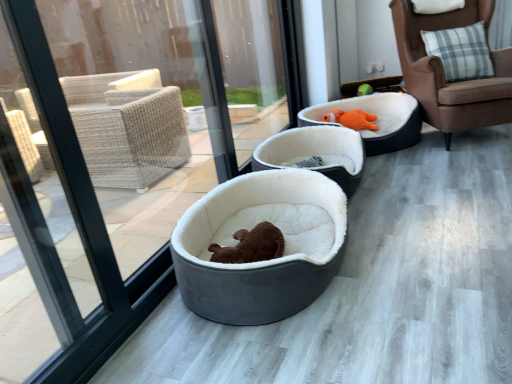
You are a GUI agent. You are given a task and a screenshot of the screen. Output one action in this format:
    pyautogui.click(x=<x>, y=<y>)
    Task: Click on the orange plush toy at upper right
    This screenshot has width=512, height=384.
    Given the screenshot: What is the action you would take?
    pyautogui.click(x=352, y=119)

Image resolution: width=512 pixels, height=384 pixels. I want to click on velvet gray dog bed at center, which ranks as the 1th dog bed in front-to-back order, so click(x=256, y=262).

You are a GUI agent. You are given a task and a screenshot of the screen. Output one action in this format:
    pyautogui.click(x=<x>, y=<y>)
    Task: Click on the soft white fur bed at center, acting as the second dog bed starting from the front
    
    Given the screenshot: What is the action you would take?
    pyautogui.click(x=316, y=153)

Does velvet gray dog bed at center, which ranks as the 1th dog bed in front-to-back order, appear on the right side of orange plush toy at upper right?

No, velvet gray dog bed at center, which ranks as the 1th dog bed in front-to-back order, is not to the right of orange plush toy at upper right.

What's the angular difference between velvet gray dog bed at center, which is the 3th dog bed in back-to-front order, and orange plush toy at upper right's facing directions?

There is a 78.2-degree angle between the facing directions of velvet gray dog bed at center, which is the 3th dog bed in back-to-front order, and orange plush toy at upper right.

Is point (343, 232) in front of point (359, 115)?

Yes, it is.

Which is in front, velvet gray dog bed at center, which ranks as the 1th dog bed in front-to-back order, or orange plush toy at upper right?

velvet gray dog bed at center, which ranks as the 1th dog bed in front-to-back order, is in front.

From the image's perspective, is velvet gray dog bed at center, which ranks as the 1th dog bed in front-to-back order, under soft white fur bed at center, positioned as the 2th dog bed in back-to-front order?

Yes, from the image's perspective, velvet gray dog bed at center, which ranks as the 1th dog bed in front-to-back order, is below soft white fur bed at center, positioned as the 2th dog bed in back-to-front order.

Considering the points (332, 276) and (354, 164), which point is in front, point (332, 276) or point (354, 164)?

Point (332, 276)

Is velvet gray dog bed at center, which is the 3th dog bed in back-to-front order, facing away from soft white fur bed at center, positioned as the 2th dog bed in back-to-front order?

No, velvet gray dog bed at center, which is the 3th dog bed in back-to-front order,'s orientation is not away from soft white fur bed at center, positioned as the 2th dog bed in back-to-front order.

Are soft white fur bed at center, positioned as the 2th dog bed in back-to-front order, and velvet gray dog bed at center, which is the 3th dog bed in back-to-front order, located far from each other?

That's not correct — soft white fur bed at center, positioned as the 2th dog bed in back-to-front order, is a little close to velvet gray dog bed at center, which is the 3th dog bed in back-to-front order.

Could you tell me if soft white fur bed at center, acting as the second dog bed starting from the front, is turned towards velvet gray dog bed at center, which is the 3th dog bed in back-to-front order?

No, soft white fur bed at center, acting as the second dog bed starting from the front, is not turned towards velvet gray dog bed at center, which is the 3th dog bed in back-to-front order.

In the scene shown: Can you confirm if soft white fur bed at center, positioned as the 2th dog bed in back-to-front order, is taller than velvet gray dog bed at center, which is the 3th dog bed in back-to-front order?

In fact, soft white fur bed at center, positioned as the 2th dog bed in back-to-front order, may be shorter than velvet gray dog bed at center, which is the 3th dog bed in back-to-front order.

Where is `dog bed that appears on the right of soft white fur bed at center, positioned as the 2th dog bed in back-to-front order`? Image resolution: width=512 pixels, height=384 pixels. dog bed that appears on the right of soft white fur bed at center, positioned as the 2th dog bed in back-to-front order is located at coordinates (376, 120).

Is soft white fur bed at center, positioned as the 2th dog bed in back-to-front order, facing away from velvet orange plush bed at center, which is the third dog bed in front-to-back order?

No, soft white fur bed at center, positioned as the 2th dog bed in back-to-front order, is not facing the opposite direction of velvet orange plush bed at center, which is the third dog bed in front-to-back order.

Is soft white fur bed at center, acting as the second dog bed starting from the front, wider than velvet orange plush bed at center, which is the third dog bed in front-to-back order?

Incorrect, the width of soft white fur bed at center, acting as the second dog bed starting from the front, does not surpass that of velvet orange plush bed at center, which is the third dog bed in front-to-back order.

Considering the sizes of objects soft white fur bed at center, positioned as the 2th dog bed in back-to-front order, and velvet orange plush bed at center, acting as the 1th dog bed starting from the back, in the image provided, who is shorter, soft white fur bed at center, positioned as the 2th dog bed in back-to-front order, or velvet orange plush bed at center, acting as the 1th dog bed starting from the back,?

soft white fur bed at center, positioned as the 2th dog bed in back-to-front order.

How different are the orientations of orange plush toy at upper right and velvet orange plush bed at center, acting as the 1th dog bed starting from the back, in degrees?

They differ by 24.8 degrees in their facing directions.

Is orange plush toy at upper right touching velvet orange plush bed at center, acting as the 1th dog bed starting from the back?

orange plush toy at upper right and velvet orange plush bed at center, acting as the 1th dog bed starting from the back, are not in contact.

In the scene shown: Is orange plush toy at upper right facing towards velvet orange plush bed at center, acting as the 1th dog bed starting from the back?

Yes, orange plush toy at upper right is facing velvet orange plush bed at center, acting as the 1th dog bed starting from the back.

In the scene shown: Is orange plush toy at upper right bigger or smaller than velvet orange plush bed at center, acting as the 1th dog bed starting from the back?

orange plush toy at upper right is smaller than velvet orange plush bed at center, acting as the 1th dog bed starting from the back.

Which of these two, orange plush toy at upper right or soft white fur bed at center, acting as the second dog bed starting from the front, is thinner?

Thinner between the two is orange plush toy at upper right.

Looking at this image, is soft white fur bed at center, acting as the second dog bed starting from the front, located within orange plush toy at upper right?

No.

Is point (334, 118) closer to camera compared to point (266, 148)?

That is False.

From the orange plush toy at upper right, count the 1st dog bed to the left and point to it. Please provide its 2D coordinates.

[(316, 153)]

Is soft white fur bed at center, positioned as the 2th dog bed in back-to-front order, outside of orange plush toy at upper right?

soft white fur bed at center, positioned as the 2th dog bed in back-to-front order, lies outside orange plush toy at upper right's area.

Which object is wider, soft white fur bed at center, positioned as the 2th dog bed in back-to-front order, or orange plush toy at upper right?

With larger width is soft white fur bed at center, positioned as the 2th dog bed in back-to-front order.

Which is closer to the camera, [334,165] or [369,124]?

The point [334,165] is closer.

Find the location of a particular element. This screenshot has width=512, height=384. animal above the velvet gray dog bed at center, which is the 3th dog bed in back-to-front order (from the image's perspective) is located at coordinates (352, 119).

This screenshot has height=384, width=512. What are the coordinates of `dog bed on the left of soft white fur bed at center, positioned as the 2th dog bed in back-to-front order` in the screenshot? It's located at (256, 262).

Considering their positions, is orange plush toy at upper right positioned further to velvet gray dog bed at center, which ranks as the 1th dog bed in front-to-back order, than velvet orange plush bed at center, which is the third dog bed in front-to-back order?

The object further to velvet gray dog bed at center, which ranks as the 1th dog bed in front-to-back order, is orange plush toy at upper right.

From the image, which object appears to be nearer to velvet orange plush bed at center, acting as the 1th dog bed starting from the back, brown leather chair at right or orange plush toy at upper right?

The object closer to velvet orange plush bed at center, acting as the 1th dog bed starting from the back, is orange plush toy at upper right.

When comparing their distances from orange plush toy at upper right, does velvet orange plush bed at center, which is the third dog bed in front-to-back order, or velvet gray dog bed at center, which ranks as the 1th dog bed in front-to-back order, seem further?

Among the two, velvet gray dog bed at center, which ranks as the 1th dog bed in front-to-back order, is located further to orange plush toy at upper right.

When comparing their distances from velvet gray dog bed at center, which ranks as the 1th dog bed in front-to-back order, does brown leather chair at right or orange plush toy at upper right seem closer?

orange plush toy at upper right is closer to velvet gray dog bed at center, which ranks as the 1th dog bed in front-to-back order.

When comparing their distances from brown leather chair at right, does velvet orange plush bed at center, acting as the 1th dog bed starting from the back, or soft white fur bed at center, positioned as the 2th dog bed in back-to-front order, seem further?

soft white fur bed at center, positioned as the 2th dog bed in back-to-front order.

Estimate the real-world distances between objects in this image. Which object is closer to soft white fur bed at center, acting as the second dog bed starting from the front, orange plush toy at upper right or brown leather chair at right?

orange plush toy at upper right.

Estimate the real-world distances between objects in this image. Which object is further from velvet orange plush bed at center, acting as the 1th dog bed starting from the back, soft white fur bed at center, positioned as the 2th dog bed in back-to-front order, or brown leather chair at right?

The object further to velvet orange plush bed at center, acting as the 1th dog bed starting from the back, is brown leather chair at right.

Estimate the real-world distances between objects in this image. Which object is further from orange plush toy at upper right, brown leather chair at right or soft white fur bed at center, acting as the second dog bed starting from the front?

The object further to orange plush toy at upper right is brown leather chair at right.

At what (x,y) coordinates should I click in order to perform the action: click on dog bed between velvet gray dog bed at center, which ranks as the 1th dog bed in front-to-back order, and velvet orange plush bed at center, which is the third dog bed in front-to-back order, from front to back. Please return your answer as a coordinate pair (x, y). Looking at the image, I should click on (316, 153).

At what (x,y) coordinates should I click in order to perform the action: click on chair between velvet gray dog bed at center, which is the 3th dog bed in back-to-front order, and orange plush toy at upper right in the front-back direction. Please return your answer as a coordinate pair (x, y). Looking at the image, I should click on (444, 73).

Identify the location of dog bed located between soft white fur bed at center, positioned as the 2th dog bed in back-to-front order, and orange plush toy at upper right in the depth direction. Image resolution: width=512 pixels, height=384 pixels. (376, 120).

This screenshot has width=512, height=384. What are the coordinates of `dog bed located between soft white fur bed at center, acting as the second dog bed starting from the front, and brown leather chair at right in the left-right direction` in the screenshot? It's located at (376, 120).